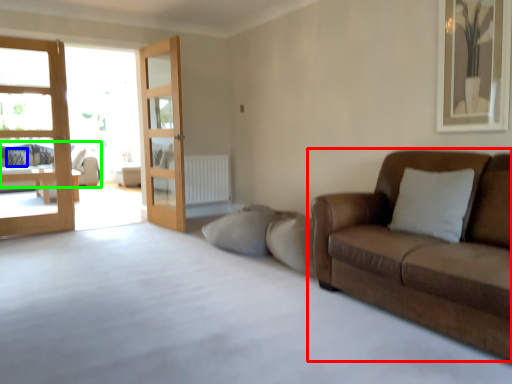
Question: Which object is the farthest from studio couch (highlighted by a red box)? Choose among these: pillow (highlighted by a blue box) or studio couch (highlighted by a green box).

Choices:
 (A) pillow
 (B) studio couch

Answer: (B)